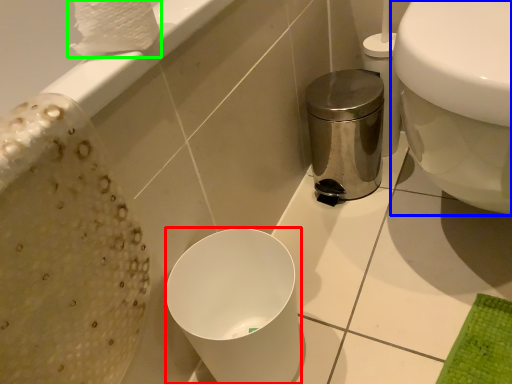
Question: Estimate the real-world distances between objects in this image. Which object is closer to bidet (highlighted by a red box), toilet (highlighted by a blue box) or toilet paper (highlighted by a green box)?

Choices:
 (A) toilet
 (B) toilet paper

Answer: (A)